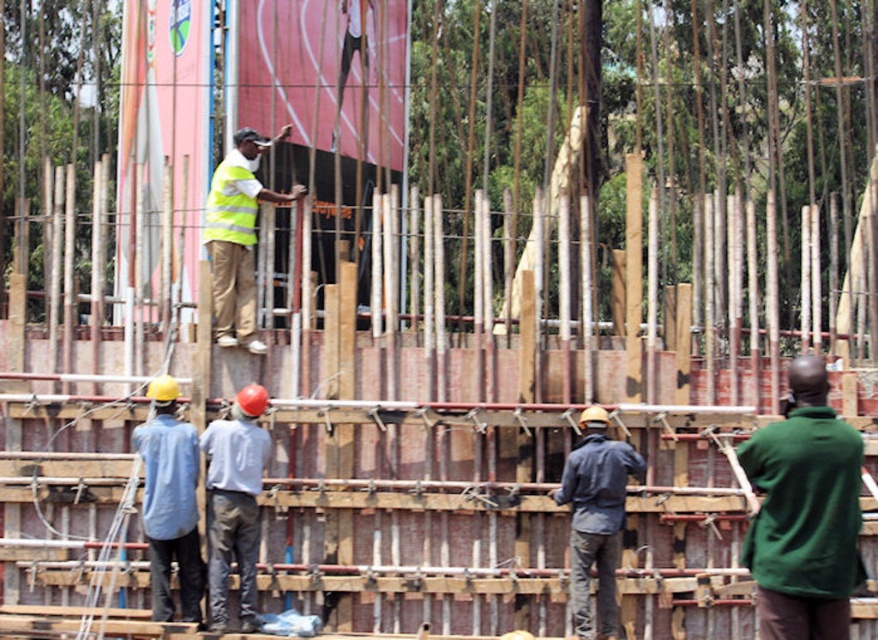
Who is positioned more to the right, light blue shirt at lower left or high-visibility reflective vest at center?

high-visibility reflective vest at center

Who is higher up, light blue shirt at lower left or high-visibility reflective vest at center?

high-visibility reflective vest at center is higher up.

Locate an element on the screen. The height and width of the screenshot is (640, 878). light blue shirt at lower left is located at coordinates (170, 502).

You are a GUI agent. You are given a task and a screenshot of the screen. Output one action in this format:
    pyautogui.click(x=<x>, y=<y>)
    Task: Click on the light blue shirt at lower left
    This screenshot has width=878, height=640.
    Given the screenshot: What is the action you would take?
    pyautogui.click(x=170, y=502)

Between light blue shirt at center and dark blue denim jacket at center, which one is positioned higher?

light blue shirt at center is higher up.

Does light blue shirt at center come in front of dark blue denim jacket at center?

Yes, it is in front of dark blue denim jacket at center.

Locate an element on the screen. The width and height of the screenshot is (878, 640). light blue shirt at center is located at coordinates (234, 502).

Can you confirm if light blue shirt at center is positioned to the left of high-visibility reflective vest at center?

Incorrect, light blue shirt at center is not on the left side of high-visibility reflective vest at center.

Does light blue shirt at center have a smaller size compared to high-visibility reflective vest at center?

No.

Does point (249, 480) come farther from viewer compared to point (293, 195)?

That is False.

This screenshot has width=878, height=640. In order to click on light blue shirt at center in this screenshot , I will do `click(234, 502)`.